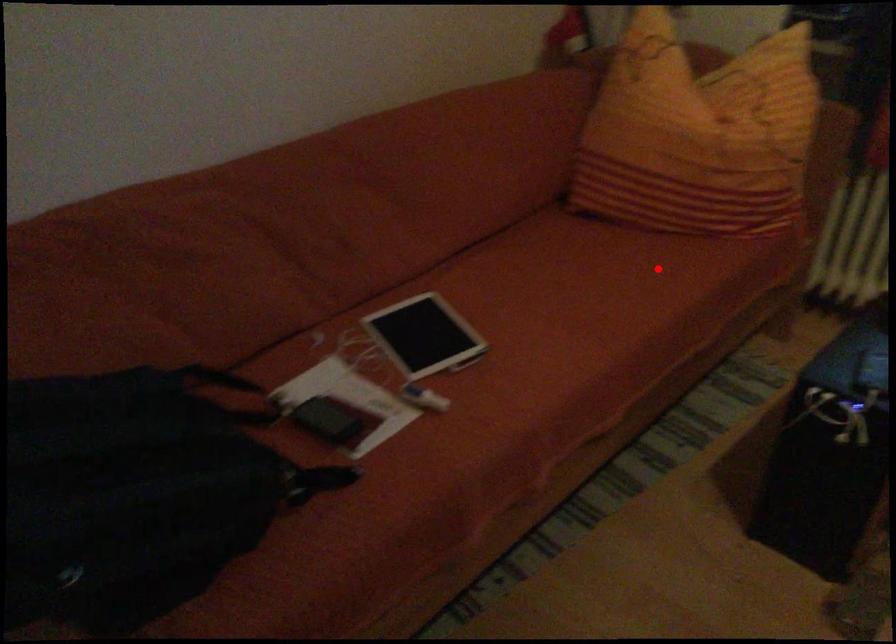
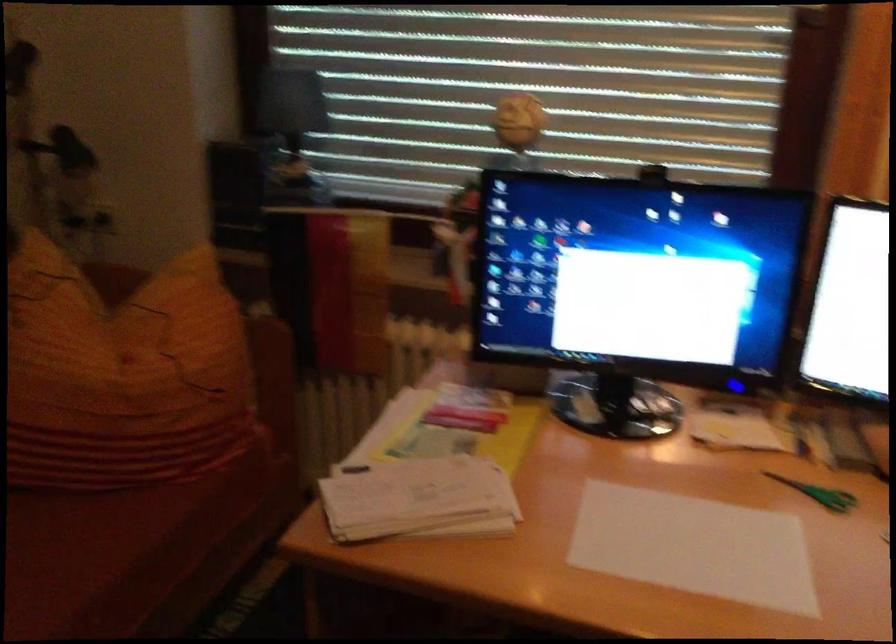
Question: A red point is marked in image1. In image2, is the corresponding 3D point closer to the camera or farther? Reply with the corresponding letter.

Choices:
 (A) The corresponding 3D point is closer.
 (B) The corresponding 3D point is farther.

Answer: (A)